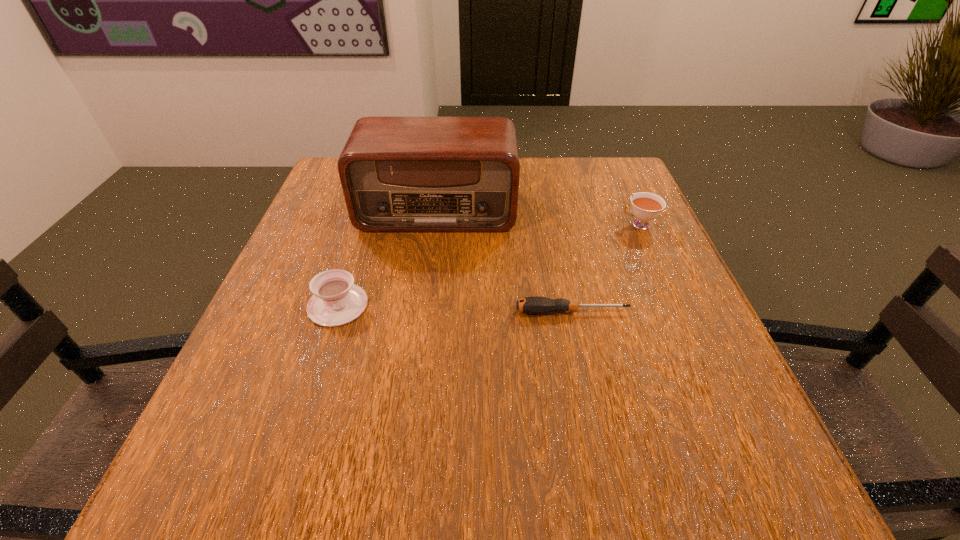
Locate an element on the screen. radio receiver is located at coordinates (399, 174).

Where is `the rightmost object`? Image resolution: width=960 pixels, height=540 pixels. the rightmost object is located at coordinates (646, 206).

Identify the location of the right teacup. The height and width of the screenshot is (540, 960). (646, 206).

This screenshot has height=540, width=960. Identify the location of the nearer teacup. (336, 301).

You are a GUI agent. You are given a task and a screenshot of the screen. Output one action in this format:
    pyautogui.click(x=<x>, y=<y>)
    Task: Click on the shortest object
    
    Given the screenshot: What is the action you would take?
    pyautogui.click(x=535, y=305)

Where is `vacant space located on the front panel of the radio receiver`? The width and height of the screenshot is (960, 540). vacant space located on the front panel of the radio receiver is located at coordinates (422, 329).

The height and width of the screenshot is (540, 960). Find the location of `free space located on the side of the rightmost object with the handle`. free space located on the side of the rightmost object with the handle is located at coordinates (546, 225).

At what (x,y) coordinates should I click in order to perform the action: click on vacant space located on the side of the rightmost object with the handle. Please return your answer as a coordinate pair (x, y). The image size is (960, 540). Looking at the image, I should click on pos(589,225).

You are a GUI agent. You are given a task and a screenshot of the screen. Output one action in this format:
    pyautogui.click(x=<x>, y=<y>)
    Task: Click on the vacant space located on the side of the rightmost object with the handle
    
    Given the screenshot: What is the action you would take?
    pyautogui.click(x=564, y=225)

This screenshot has width=960, height=540. I want to click on free spot located on the back of the screwdriver, so click(x=547, y=192).